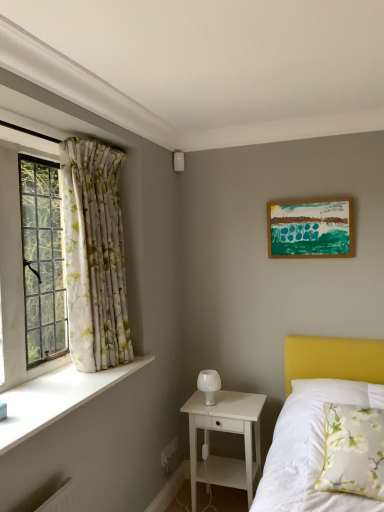
Question: Is white frosted glass table lamp at center positioned before white floral pillow at lower right?

Choices:
 (A) no
 (B) yes

Answer: (A)

Question: From a real-world perspective, is white frosted glass table lamp at center on white floral pillow at lower right?

Choices:
 (A) no
 (B) yes

Answer: (B)

Question: Can you confirm if white frosted glass table lamp at center is bigger than white floral pillow at lower right?

Choices:
 (A) no
 (B) yes

Answer: (A)

Question: Are white frosted glass table lamp at center and white floral pillow at lower right making contact?

Choices:
 (A) no
 (B) yes

Answer: (A)

Question: From a real-world perspective, does white frosted glass table lamp at center sit lower than white floral pillow at lower right?

Choices:
 (A) no
 (B) yes

Answer: (A)

Question: From the image's perspective, is white frosted glass table lamp at center located above white floral pillow at lower right?

Choices:
 (A) no
 (B) yes

Answer: (B)

Question: Would you say white frosted glass table lamp at center is outside clear glass window at left?

Choices:
 (A) yes
 (B) no

Answer: (A)

Question: From a real-world perspective, does white frosted glass table lamp at center stand above clear glass window at left?

Choices:
 (A) yes
 (B) no

Answer: (B)

Question: Are white frosted glass table lamp at center and clear glass window at left located far from each other?

Choices:
 (A) yes
 (B) no

Answer: (A)

Question: Is the surface of white frosted glass table lamp at center in direct contact with clear glass window at left?

Choices:
 (A) yes
 (B) no

Answer: (B)

Question: Is the depth of white frosted glass table lamp at center less than that of clear glass window at left?

Choices:
 (A) no
 (B) yes

Answer: (A)

Question: Is white frosted glass table lamp at center taller than clear glass window at left?

Choices:
 (A) yes
 (B) no

Answer: (B)

Question: Could you tell me if white smooth window sill at left is facing wooden picture frame at upper right?

Choices:
 (A) yes
 (B) no

Answer: (B)